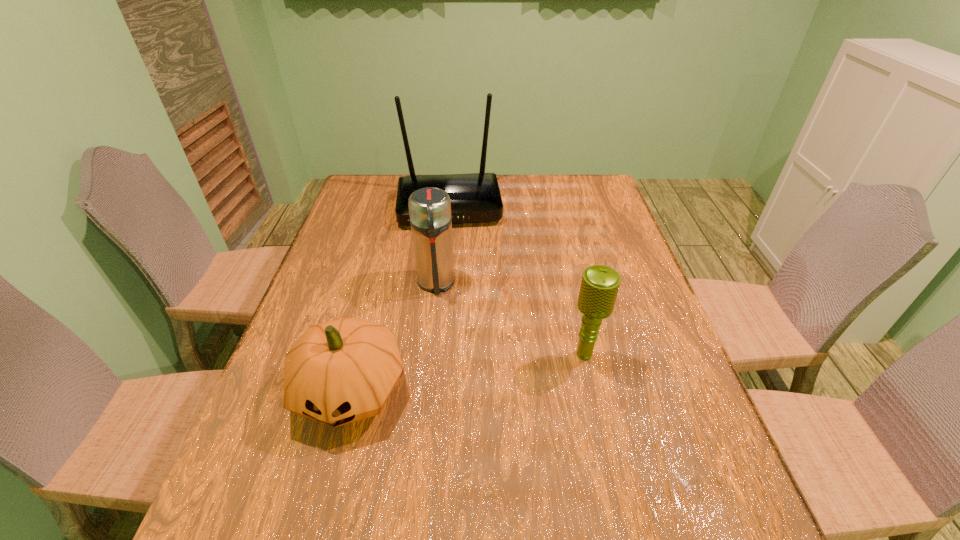
Find the location of `free space located with a handle on the side of the second farthest object`. free space located with a handle on the side of the second farthest object is located at coordinates (438, 322).

Where is `vacant space situated with a handle on the side of the second farthest object`? Image resolution: width=960 pixels, height=540 pixels. vacant space situated with a handle on the side of the second farthest object is located at coordinates (438, 319).

Locate an element on the screen. object located at the far edge is located at coordinates point(475,197).

You are a GUI agent. You are given a task and a screenshot of the screen. Output one action in this format:
    pyautogui.click(x=<x>, y=<y>)
    Task: Click on the object positioned at the near edge
    
    Given the screenshot: What is the action you would take?
    pyautogui.click(x=341, y=371)

Where is `object at the left edge`? object at the left edge is located at coordinates (341, 371).

I want to click on object located in the near left corner section of the desktop, so click(341, 371).

Identify the location of vacant area at the far edge. This screenshot has height=540, width=960. (557, 186).

Where is `free location at the near edge of the desktop`? free location at the near edge of the desktop is located at coordinates (332, 483).

Find the location of a particular element. vacant space at the left edge of the desktop is located at coordinates (263, 428).

The image size is (960, 540). I want to click on vacant space at the right edge of the desktop, so click(x=573, y=218).